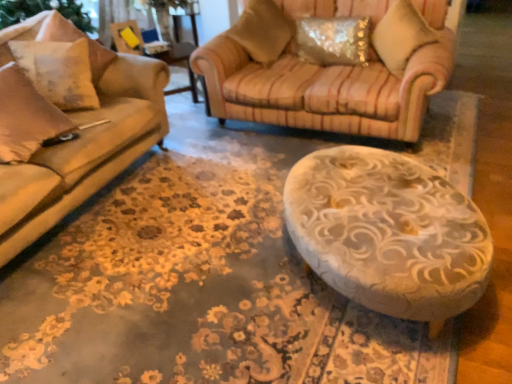
Question: Considering the relative positions of velvet striped pillow at upper right, which is the 4th pillow in left-to-right order, and white textured pillow at left, which is the 4th pillow in right-to-left order, in the image provided, is velvet striped pillow at upper right, which is the 4th pillow in left-to-right order, to the right of white textured pillow at left, which is the 4th pillow in right-to-left order, from the viewer's perspective?

Choices:
 (A) no
 (B) yes

Answer: (B)

Question: Considering the relative sizes of velvet striped pillow at upper right, which is the 4th pillow in left-to-right order, and white textured pillow at left, arranged as the 1th pillow when viewed from the left, in the image provided, is velvet striped pillow at upper right, which is the 4th pillow in left-to-right order, thinner than white textured pillow at left, arranged as the 1th pillow when viewed from the left,?

Choices:
 (A) no
 (B) yes

Answer: (A)

Question: Is white textured pillow at left, arranged as the 1th pillow when viewed from the left, surrounded by velvet striped pillow at upper right, which is the 4th pillow in left-to-right order?

Choices:
 (A) yes
 (B) no

Answer: (B)

Question: Can you confirm if velvet striped pillow at upper right, which appears as the first pillow when viewed from the right, is shorter than white textured pillow at left, arranged as the 1th pillow when viewed from the left?

Choices:
 (A) no
 (B) yes

Answer: (A)

Question: Is velvet striped pillow at upper right, which appears as the first pillow when viewed from the right, far from white textured pillow at left, which is the 4th pillow in right-to-left order?

Choices:
 (A) no
 (B) yes

Answer: (B)

Question: Is velvet striped pillow at upper right, which appears as the first pillow when viewed from the right, behind white textured pillow at left, which is the 4th pillow in right-to-left order?

Choices:
 (A) no
 (B) yes

Answer: (B)

Question: Is textured beige pillow at upper center, acting as the third pillow starting from the right, surrounding yellow plastic swivel chair at upper left?

Choices:
 (A) yes
 (B) no

Answer: (B)

Question: Is textured beige pillow at upper center, acting as the third pillow starting from the right, at the right side of yellow plastic swivel chair at upper left?

Choices:
 (A) yes
 (B) no

Answer: (A)

Question: From a real-world perspective, is textured beige pillow at upper center, acting as the third pillow starting from the right, under yellow plastic swivel chair at upper left?

Choices:
 (A) no
 (B) yes

Answer: (B)

Question: Is textured beige pillow at upper center, acting as the third pillow starting from the right, positioned far away from yellow plastic swivel chair at upper left?

Choices:
 (A) no
 (B) yes

Answer: (A)

Question: Can we say textured beige pillow at upper center, acting as the third pillow starting from the right, lies outside yellow plastic swivel chair at upper left?

Choices:
 (A) no
 (B) yes

Answer: (B)

Question: Considering the relative positions of textured beige pillow at upper center, the 2th pillow viewed from the left, and yellow plastic swivel chair at upper left in the image provided, is textured beige pillow at upper center, the 2th pillow viewed from the left, in front of yellow plastic swivel chair at upper left?

Choices:
 (A) no
 (B) yes

Answer: (B)

Question: Would you consider sparkly metallic pillow at upper right, the 3th pillow in the left-to-right sequence, to be distant from textured beige pillow at upper center, the 2th pillow viewed from the left?

Choices:
 (A) no
 (B) yes

Answer: (A)